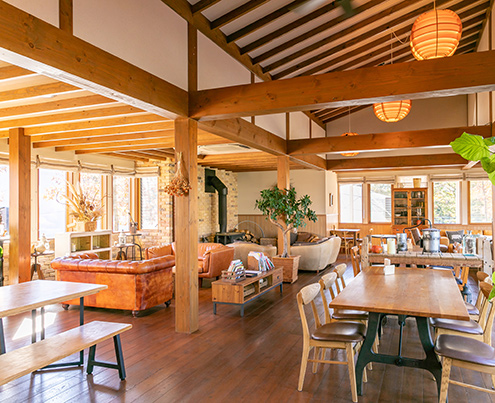
Find the location of `tables`. tables is located at coordinates (46, 292), (368, 311), (454, 260).